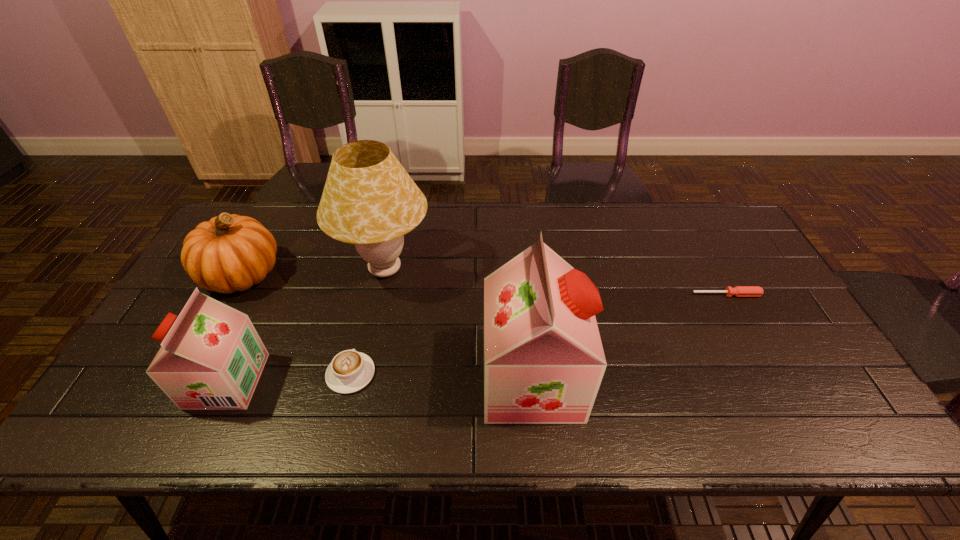
Identify the location of the left soya milk. The height and width of the screenshot is (540, 960). pos(211,358).

Identify the location of the fifth object from left to right. [544, 361].

Where is `the right soya milk`? The image size is (960, 540). the right soya milk is located at coordinates (544, 361).

Image resolution: width=960 pixels, height=540 pixels. Find the location of `lampshade`. lampshade is located at coordinates (369, 200).

I want to click on the shortest object, so click(x=739, y=291).

I want to click on the rightmost object, so click(x=739, y=291).

Identify the location of pumpkin. (229, 253).

This screenshot has width=960, height=540. Identify the location of the fifth tallest object. (350, 371).

I want to click on vacant space located with the cap open on the left soya milk, so click(166, 381).

Locate an element on the screen. This screenshot has height=540, width=960. free region located with the cap open on the left soya milk is located at coordinates (133, 381).